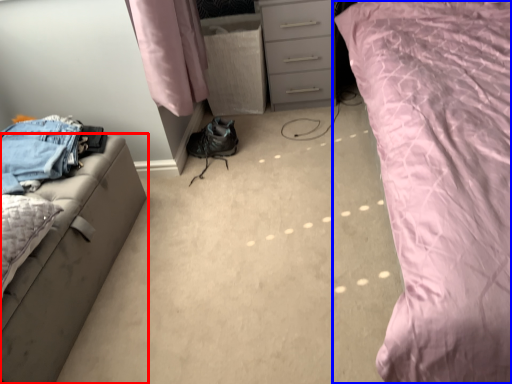
Question: Which object is closer to the camera taking this photo, furniture (highlighted by a red box) or bed (highlighted by a blue box)?

Choices:
 (A) furniture
 (B) bed

Answer: (B)